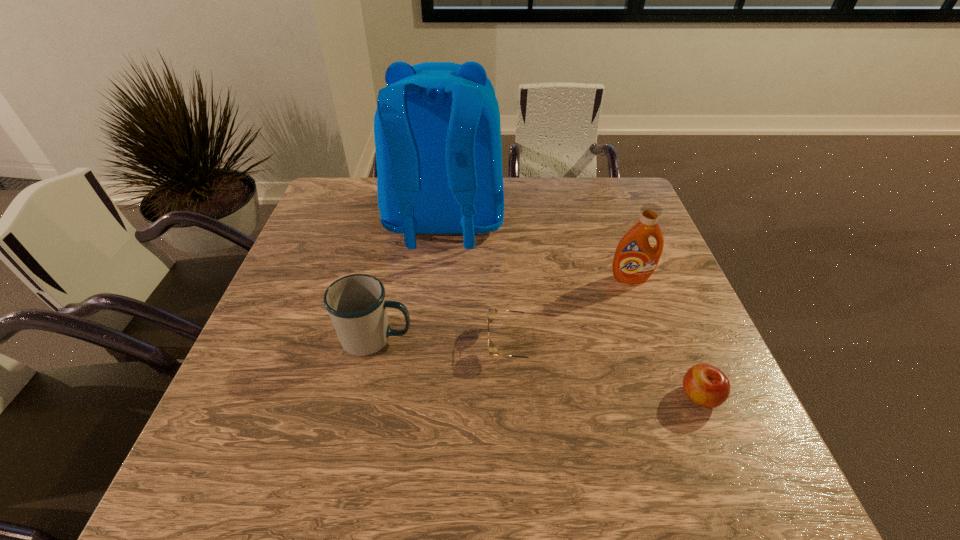
The image size is (960, 540). Identify the location of free region located on the handle side of the mug. (471, 339).

Locate an element on the screen. free space located 0.160m on the front of the nearest object is located at coordinates (744, 503).

Image resolution: width=960 pixels, height=540 pixels. I want to click on blank area located on the front lenses of the shortest object, so (424, 343).

The image size is (960, 540). I want to click on free location located on the front lenses of the shortest object, so click(x=416, y=343).

The width and height of the screenshot is (960, 540). I want to click on vacant space situated 0.060m on the front lenses of the shortest object, so click(461, 343).

Where is `object at the far edge`? object at the far edge is located at coordinates (437, 130).

Where is `detergent that is at the right edge`? detergent that is at the right edge is located at coordinates (635, 259).

Image resolution: width=960 pixels, height=540 pixels. Find the location of `apple that is positioned at the right edge`. apple that is positioned at the right edge is located at coordinates (707, 386).

Identify the location of vacant region at the far edge of the desktop. The height and width of the screenshot is (540, 960). (519, 178).

Where is `vacant space at the near edge of the desktop`? vacant space at the near edge of the desktop is located at coordinates (450, 464).